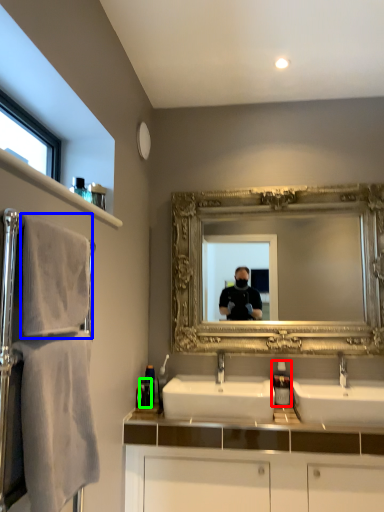
Question: Estimate the real-world distances between objects in this image. Which object is closer to soap dispenser (highlighted by a red box), bath towel (highlighted by a blue box) or toiletry (highlighted by a green box)?

Choices:
 (A) bath towel
 (B) toiletry

Answer: (B)